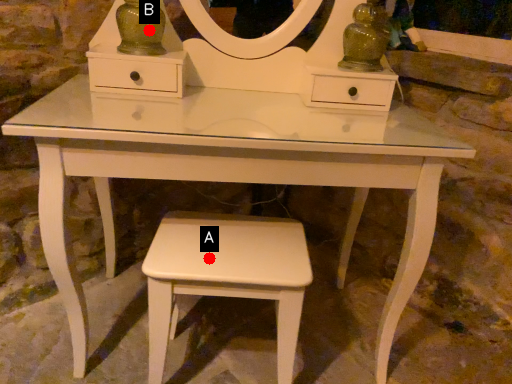
Question: Two points are circled on the image, labeled by A and B beside each circle. Which point is farther from the camera taking this photo?

Choices:
 (A) A is further
 (B) B is further

Answer: (B)